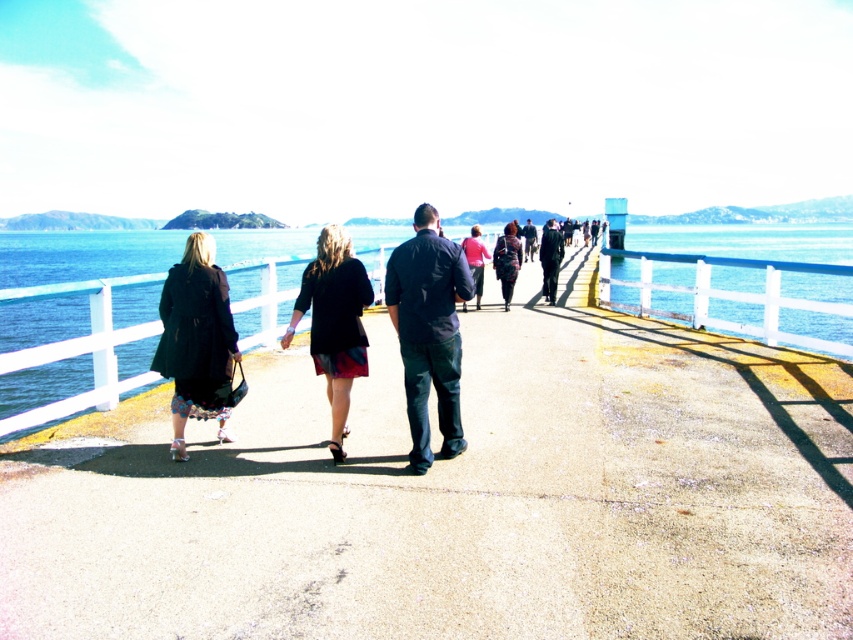
Question: Which point is closer to the camera?

Choices:
 (A) matte black coat at left
 (B) matte pink sweater at center
 (C) dark blue shirt at center

Answer: (C)

Question: Which point is closer to the camera taking this photo?

Choices:
 (A) (527, 248)
 (B) (456, 326)
 (C) (682, 403)
 (D) (799, 332)

Answer: (B)

Question: Is black leather jacket at center below fluffy black coat at center?

Choices:
 (A) yes
 (B) no

Answer: (A)

Question: Considering the real-world distances, which object is farthest from the dark blue suit at center?

Choices:
 (A) black leather jacket at center
 (B) dark blue jeans at center
 (C) matte black coat at left

Answer: (C)

Question: Does concrete at center have a greater width compared to fluffy black coat at center?

Choices:
 (A) no
 (B) yes

Answer: (B)

Question: Is the position of black leather jacket at center less distant than that of dark blue suit at center?

Choices:
 (A) yes
 (B) no

Answer: (A)